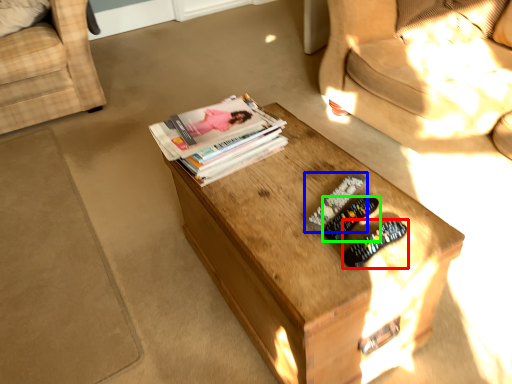
Question: Which is nearer to the remote control (highlighted by a red box)? remote control (highlighted by a blue box) or remote control (highlighted by a green box).

Choices:
 (A) remote control
 (B) remote control

Answer: (B)